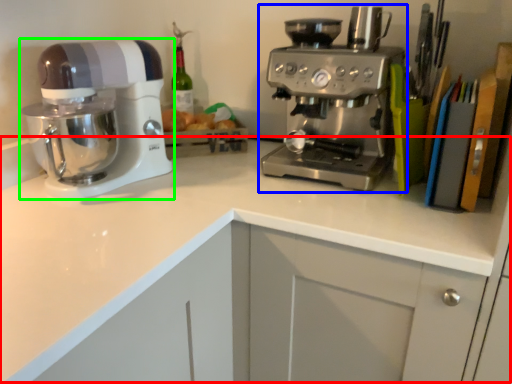
Question: Considering the real-world distances, which object is farthest from counter top (highlighted by a red box)? coffee maker (highlighted by a blue box) or mixer (highlighted by a green box)?

Choices:
 (A) coffee maker
 (B) mixer

Answer: (B)